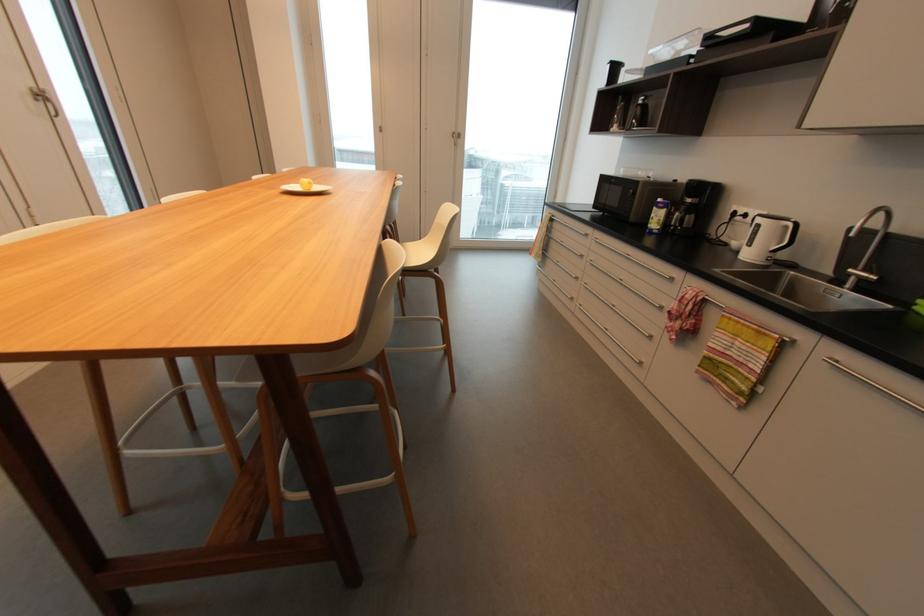
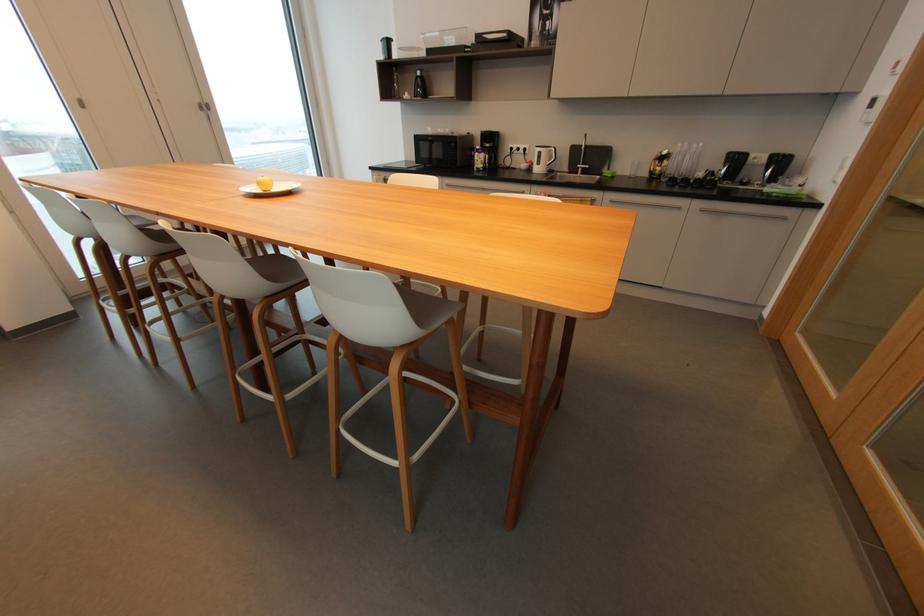
The point at [645,100] is marked in the first image. Where is the corresponding point in the second image?

(421, 74)